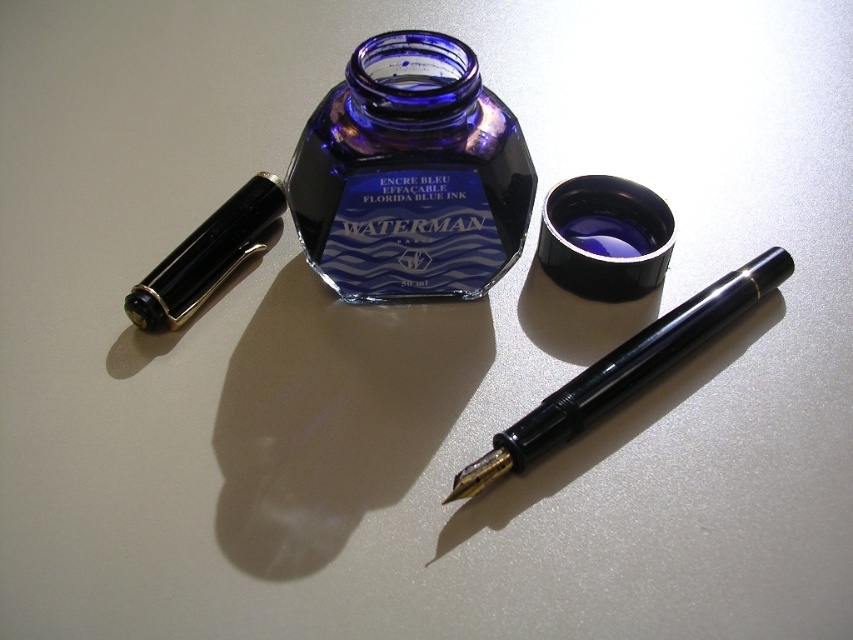
You are organizing a desk and need to place the black glossy pen at left and the blue matte ink at center. Which object is located to the right of the other?

The blue matte ink at center is located to the right of the black glossy pen at left.

What object is located at the coordinates point (x=206, y=257) in the scene?

The point (x=206, y=257) marks the location of the black glossy pen at left.

In the scene shown: You are organizing a desk and need to place the cobalt glass bottle at center and the black glossy pen at left. If you want to move the pen closer to you without moving the bottle, which direction should you move it?

Since the cobalt glass bottle at center is in front of the black glossy pen at left, moving the pen towards you would require moving it backward away from the bottle. However, since the bottle is blocking the path, you would need to move the pen to the side, either left or right, to get it closer to you without moving the bottle.